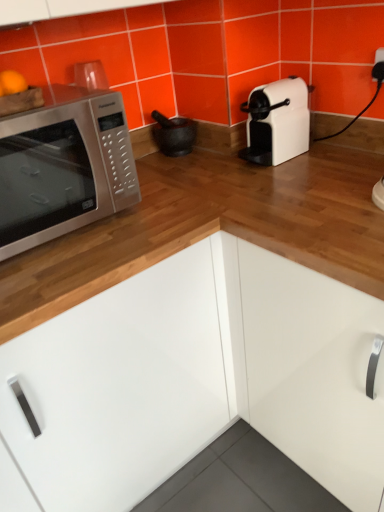
Measure the distance between matte black mortar at center and camera.

4.73 feet.

The image size is (384, 512). Describe the element at coordinates (173, 134) in the screenshot. I see `matte black mortar at center` at that location.

Identify the location of satin silver microwave at left. (63, 167).

Would you say white glossy cabinet at center is inside or outside matte black mortar at center?

white glossy cabinet at center is outside matte black mortar at center.

Is white glossy cabinet at center aimed at matte black mortar at center?

No, white glossy cabinet at center is not aimed at matte black mortar at center.

Looking at this image, from a real-world perspective, which is physically above, white glossy cabinet at center or matte black mortar at center?

matte black mortar at center.

Between white glossy cabinet at center and satin silver microwave at left, which one has smaller size?

satin silver microwave at left is smaller.

Is white glossy cabinet at center situated inside satin silver microwave at left or outside?

white glossy cabinet at center exists outside the volume of satin silver microwave at left.

Is white glossy cabinet at center taller than satin silver microwave at left?

Indeed, white glossy cabinet at center has a greater height compared to satin silver microwave at left.

Considering the relative positions of satin silver microwave at left and white glossy cabinet at center in the image provided, is satin silver microwave at left to the right of white glossy cabinet at center from the viewer's perspective?

Incorrect, satin silver microwave at left is not on the right side of white glossy cabinet at center.

Looking at this image, from the image's perspective, does satin silver microwave at left appear higher than white glossy cabinet at center?

Yes.

Would you say satin silver microwave at left is inside or outside white glossy cabinet at center?

satin silver microwave at left is not enclosed by white glossy cabinet at center.

From the image's perspective, is matte black mortar at center located above satin silver microwave at left?

Yes, from the image's perspective, matte black mortar at center is on top of satin silver microwave at left.

The height and width of the screenshot is (512, 384). I want to click on appliance beneath the satin silver microwave at left (from a real-world perspective), so [173, 134].

Is matte black mortar at center directly adjacent to satin silver microwave at left?

No, matte black mortar at center is not making contact with satin silver microwave at left.

Could satin silver microwave at left be considered to be inside matte black mortar at center?

No, satin silver microwave at left is not surrounded by matte black mortar at center.

Considering the relative sizes of satin silver microwave at left and matte black mortar at center in the image provided, is satin silver microwave at left thinner than matte black mortar at center?

In fact, satin silver microwave at left might be wider than matte black mortar at center.

Find the location of a particular element. This screenshot has width=384, height=512. appliance below the satin silver microwave at left (from a real-world perspective) is located at coordinates (173, 134).

Is point (32, 192) in front of point (164, 139)?

Yes, it is.

Considering the sizes of objects matte black mortar at center and white glossy cabinet at center in the image provided, who is shorter, matte black mortar at center or white glossy cabinet at center?

matte black mortar at center.

Is matte black mortar at center situated inside white glossy cabinet at center or outside?

matte black mortar at center is inside white glossy cabinet at center.

Locate an element on the screen. cabinetry in front of the matte black mortar at center is located at coordinates (198, 378).

Between matte black mortar at center and white glossy cabinet at center, which one appears on the left side from the viewer's perspective?

From the viewer's perspective, matte black mortar at center appears more on the left side.

I want to click on cabinetry that appears below the matte black mortar at center (from a real-world perspective), so click(198, 378).

Find the location of `microwave oven behind the white glossy cabinet at center`. microwave oven behind the white glossy cabinet at center is located at coordinates (63, 167).

Looking at this image, looking at the image, which one is located closer to matte black mortar at center, white glossy cabinet at center or satin silver microwave at left?

satin silver microwave at left is positioned closer to the anchor matte black mortar at center.

Based on their spatial positions, is satin silver microwave at left or matte black mortar at center further from white glossy cabinet at center?

matte black mortar at center is positioned further to the anchor white glossy cabinet at center.

Considering their positions, is matte black mortar at center positioned closer to white glossy cabinet at center than satin silver microwave at left?

satin silver microwave at left lies closer to white glossy cabinet at center than the other object.

Considering their positions, is white glossy cabinet at center positioned closer to satin silver microwave at left than matte black mortar at center?

Among the two, white glossy cabinet at center is located nearer to satin silver microwave at left.

Based on their spatial positions, is satin silver microwave at left or white glossy cabinet at center further from matte black mortar at center?

white glossy cabinet at center is positioned further to the anchor matte black mortar at center.

Estimate the real-world distances between objects in this image. Which object is closer to satin silver microwave at left, matte black mortar at center or white glossy cabinet at center?

white glossy cabinet at center is closer to satin silver microwave at left.

Find the location of a particular element. microwave oven between white glossy cabinet at center and matte black mortar at center from front to back is located at coordinates (63, 167).